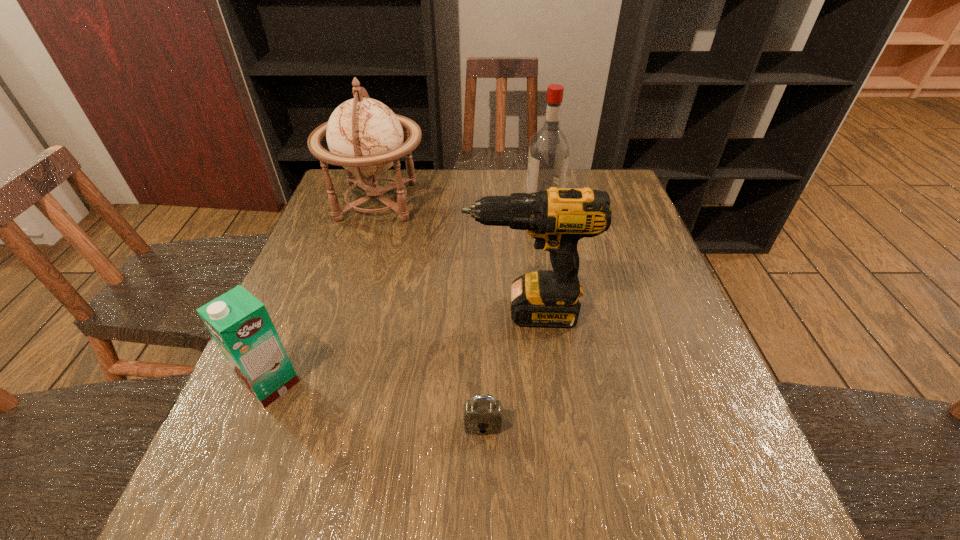
In order to click on globe in this screenshot , I will do `click(364, 136)`.

The height and width of the screenshot is (540, 960). I want to click on liquor, so click(548, 157).

Image resolution: width=960 pixels, height=540 pixels. I want to click on the third farthest object, so click(x=557, y=218).

You are a GUI agent. You are given a task and a screenshot of the screen. Output one action in this format:
    pyautogui.click(x=<x>, y=<y>)
    Task: Click on the fourth farthest object
    The height and width of the screenshot is (540, 960).
    Given the screenshot: What is the action you would take?
    pyautogui.click(x=239, y=323)

Identify the location of the second shortest object. (239, 323).

Image resolution: width=960 pixels, height=540 pixels. In order to click on padlock in this screenshot , I will do `click(482, 415)`.

Locate an element on the screen. the nearest object is located at coordinates (482, 415).

At what (x,y) coordinates should I click in order to perform the action: click on vacant position located on the front-facing side of the globe. Please return your answer as a coordinate pair (x, y). Image resolution: width=960 pixels, height=540 pixels. Looking at the image, I should click on (447, 201).

This screenshot has height=540, width=960. In order to click on free space located 0.130m on the front-facing side of the liquor in this screenshot , I will do `click(483, 201)`.

Where is `blank area located on the front-facing side of the liquor`? The width and height of the screenshot is (960, 540). blank area located on the front-facing side of the liquor is located at coordinates (400, 201).